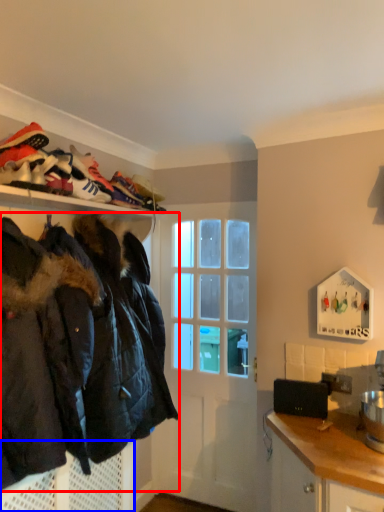
Question: Which point is further to the camera, jacket (highlighted by a red box) or cabinetry (highlighted by a blue box)?

Choices:
 (A) jacket
 (B) cabinetry

Answer: (B)